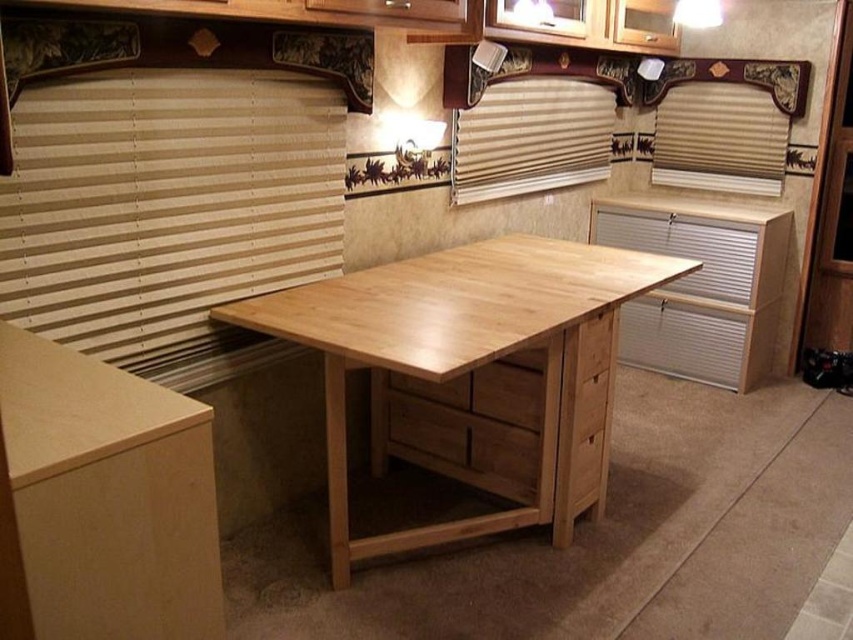
You are a delivery person who just brought a new 24 inch wide dining chair into the RV. You need to place it between the wooden blinds at left and the natural wood table at center. Will the chair fit in the space between them?

The wooden blinds at left and natural wood table at center are 22.95 inches apart from each other. Since the chair is 24 inches wide, it will not fit in the space between them as the distance is narrower than the chair.

In the scene shown: You are designing a window treatment for a small room and need to choose between the wooden blinds at left and the beige wood blinds at upper right. Based on the image, which set of blinds would allow more light into the room?

The wooden blinds at left might be wider than beige wood blinds at upper right, so they could allow more light into the room since wider slats typically permit more light passage.